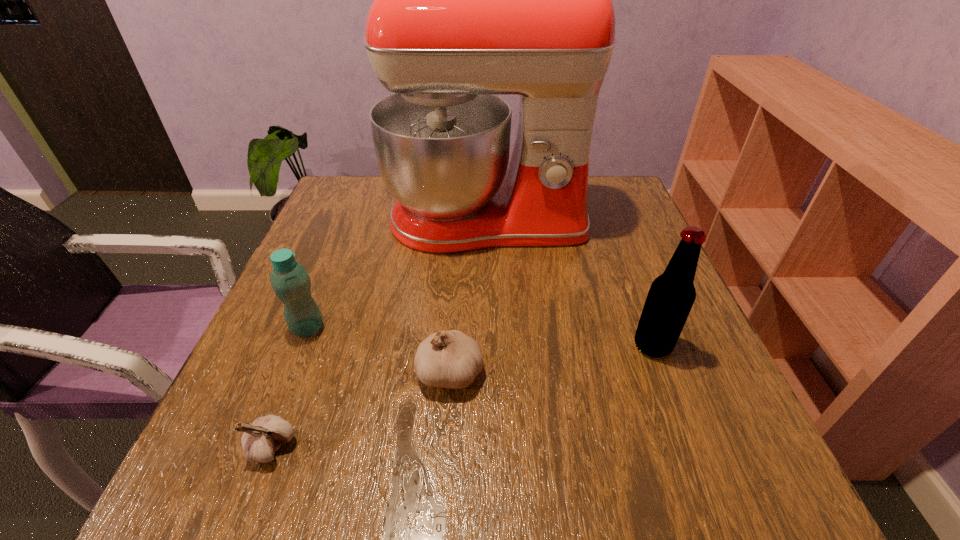
You are a GUI agent. You are given a task and a screenshot of the screen. Output one action in this format:
    pyautogui.click(x=<x>, y=<y>)
    Task: Click on the free space that satisfies the following two spatial constraints: 1. at the front cap of the third tallest object; 2. on the back side of the nearer garlic
    This screenshot has height=540, width=960.
    Given the screenshot: What is the action you would take?
    pyautogui.click(x=261, y=447)

At what (x,y) coordinates should I click in order to perform the action: click on blank area in the image that satisfies the following two spatial constraints: 1. at the front cap of the fourth shortest object; 2. on the left side of the third tallest object. Please return your answer as a coordinate pair (x, y). Looking at the image, I should click on [x=300, y=346].